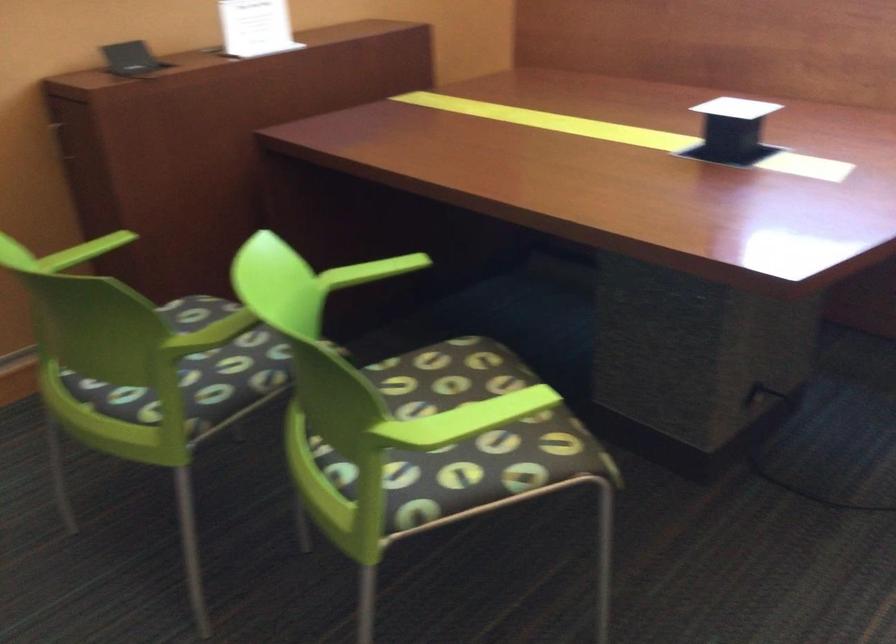
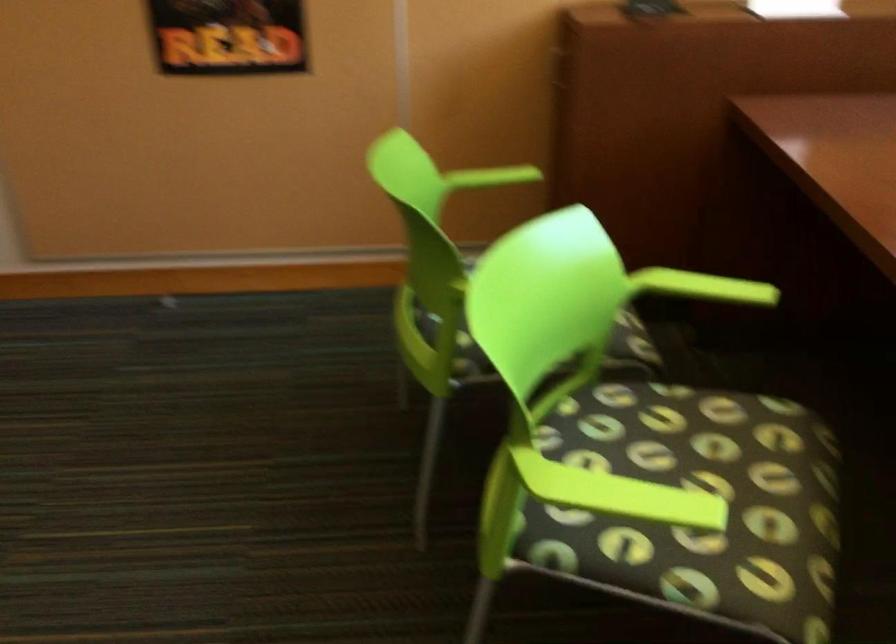
Locate, in the second image, the point that corresponds to the point at 374,270 in the first image.

(702, 287)